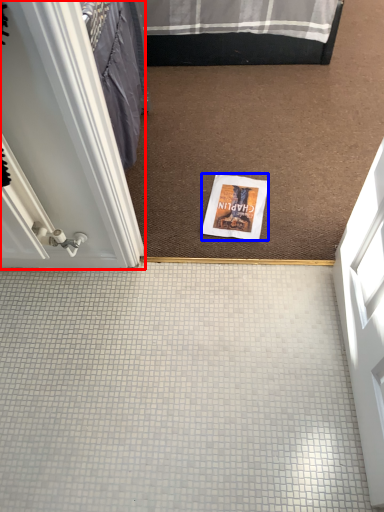
Question: Which point is further to the camera, door (highlighted by a red box) or magazine (highlighted by a blue box)?

Choices:
 (A) door
 (B) magazine

Answer: (B)